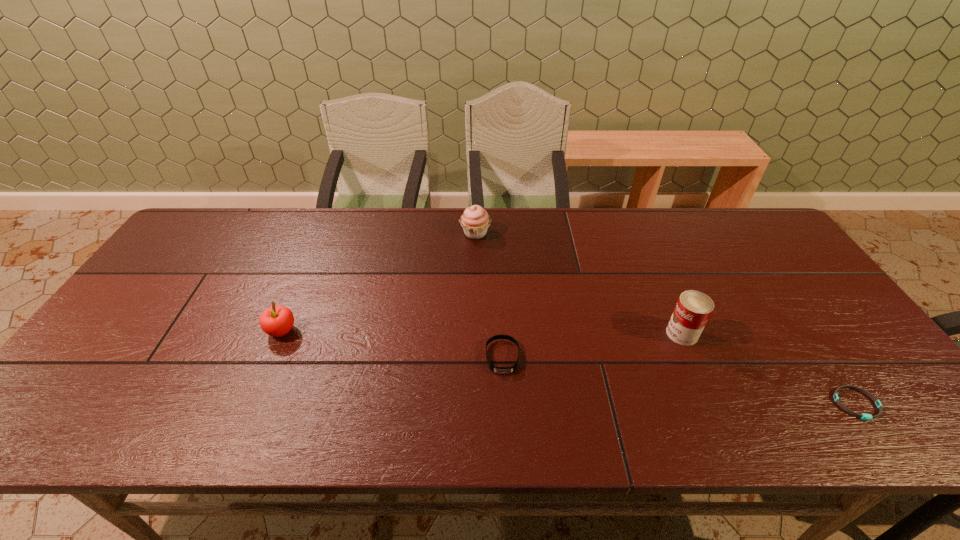
Image resolution: width=960 pixels, height=540 pixels. In order to click on can in this screenshot , I will do `click(693, 309)`.

Image resolution: width=960 pixels, height=540 pixels. I want to click on the farthest object, so click(475, 221).

You are a GUI agent. You are given a task and a screenshot of the screen. Output one action in this format:
    pyautogui.click(x=<x>, y=<y>)
    Task: Click on the apple
    Image resolution: width=960 pixels, height=540 pixels.
    Given the screenshot: What is the action you would take?
    pyautogui.click(x=276, y=321)

Identify the location of the leftmost object. This screenshot has height=540, width=960. (276, 321).

At what (x,y) coordinates should I click in order to perform the action: click on the taller wristband. Please return your answer as a coordinate pair (x, y). Looking at the image, I should click on (500, 370).

At what (x,y) coordinates should I click in order to perform the action: click on the second shortest object. Please return your answer as a coordinate pair (x, y). The height and width of the screenshot is (540, 960). Looking at the image, I should click on (500, 370).

Find the location of `the right wristband`. the right wristband is located at coordinates (863, 416).

Identify the location of the rightmost object. (863, 416).

Find the location of a particular element. The width and height of the screenshot is (960, 540). vacant area situated on the front label of the can is located at coordinates (620, 334).

The width and height of the screenshot is (960, 540). In order to click on vacant space located 0.070m on the front label of the can in this screenshot , I will do `click(639, 334)`.